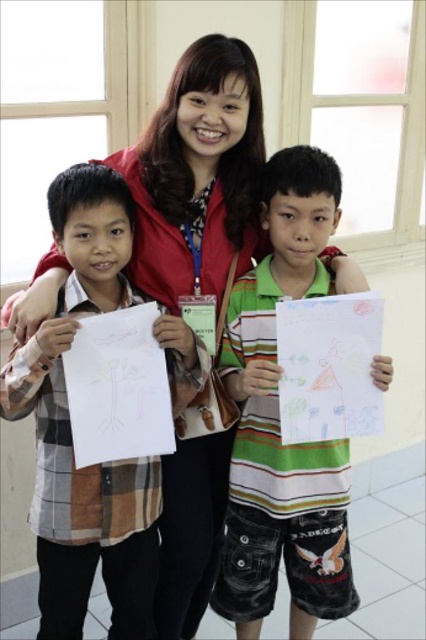
Question: Does plaid shirt at left come behind white paper at left?

Choices:
 (A) yes
 (B) no

Answer: (B)

Question: Does plaid shirt at left have a lesser width compared to white paper at left?

Choices:
 (A) yes
 (B) no

Answer: (B)

Question: Which point is closer to the camera?

Choices:
 (A) (367, 344)
 (B) (238, 280)
 (C) (88, 388)

Answer: (C)

Question: Can you confirm if plaid shirt at left is positioned to the right of white paper at left?

Choices:
 (A) yes
 (B) no

Answer: (B)

Question: Which point is farther from the camera taking this photo?

Choices:
 (A) (89, 218)
 (B) (236, 484)

Answer: (B)

Question: Which point is closer to the camera?

Choices:
 (A) (51, 490)
 (B) (94, 330)
 (C) (322, 458)
 (D) (287, 419)

Answer: (B)